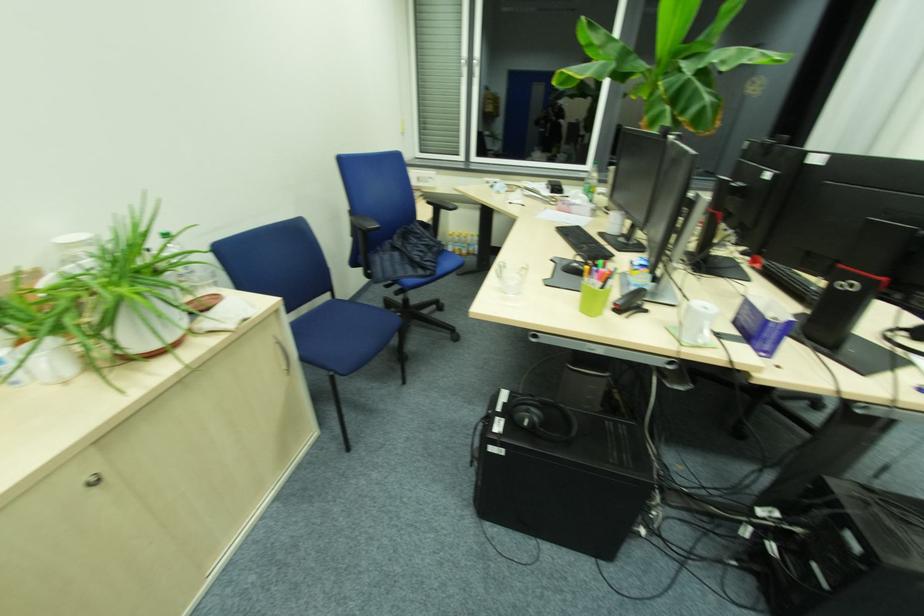
Which object does [511,277] point to?

It corresponds to the clear glass cup in the image.